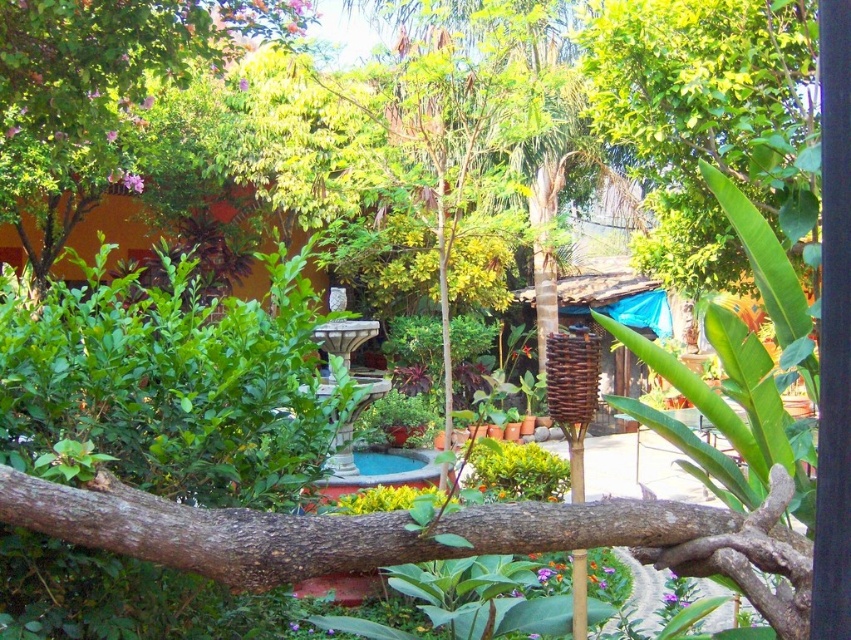
You are a gardener who needs to place a 3.5 meter long fence panel between the green leafy bush at left and the brown rough tree branch at center. Will the fence panel fit perfectly between them?

The distance between the green leafy bush at left and the brown rough tree branch at center is 3.56 meters. Since the fence panel is 3.5 meters long, it will fit with a small gap remaining between them.

You are standing in the garden and want to water the green leafy bush at left. Your watering can has a maximum reach of 6 feet. Can you water it without moving closer?

The green leafy bush at left is 6.88 feet away from the viewer, which is beyond the watering can reach of 6 feet. Therefore, you need to move closer to water it.

You are standing in the garden and want to place a small decoration between the two points, point (184, 452) and point (650, 524). Which point is closer to you so you can start placing the decoration from there?

Point (184, 452) is closer to you than point (650, 524), so you can start placing the decoration from there.